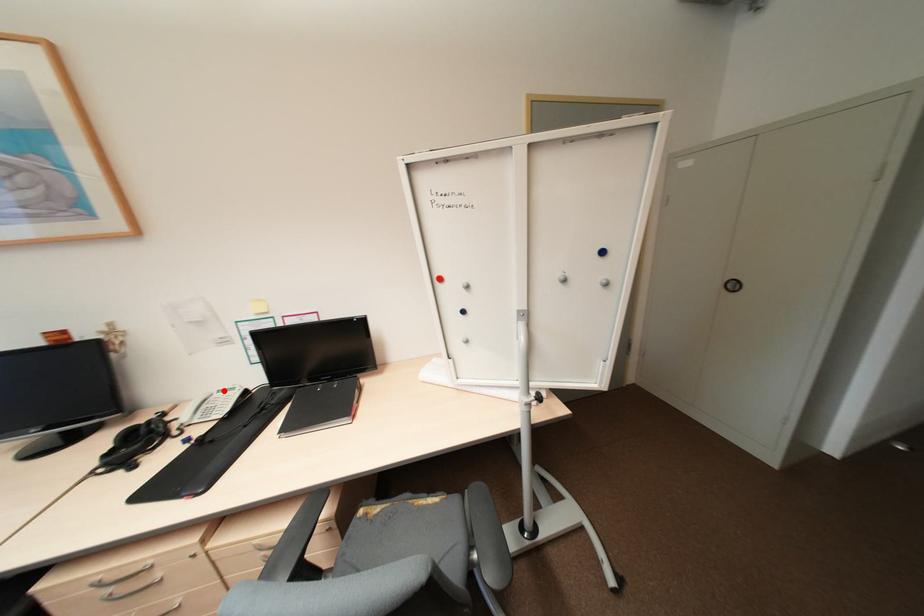
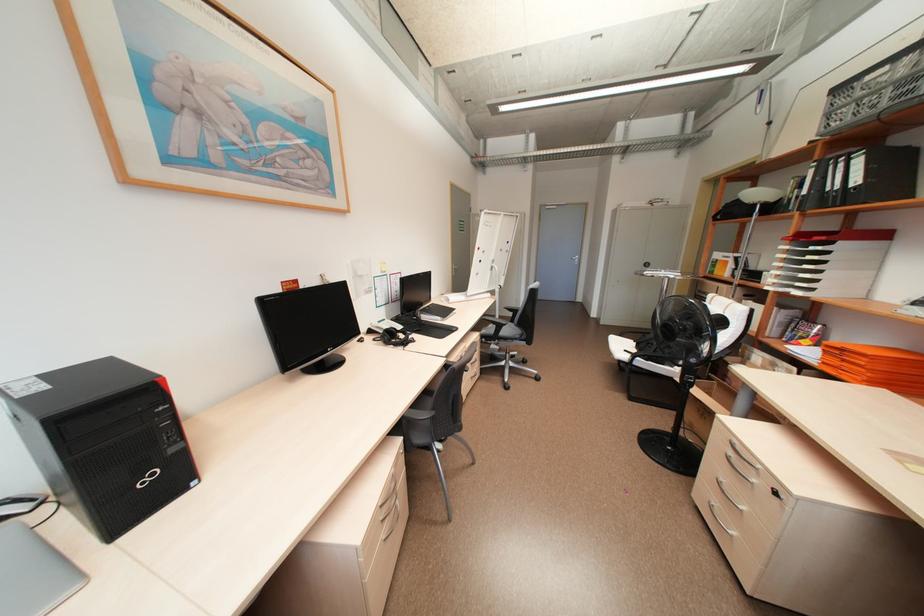
Locate, in the second image, the point that corresponds to the highlighted location in the first image.

(384, 322)